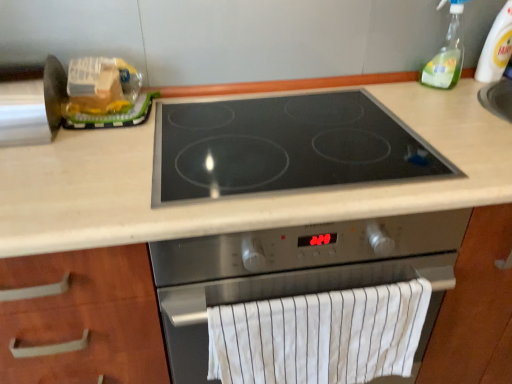
Identify the location of blank space to the left of clear plastic bottle at upper right. The width and height of the screenshot is (512, 384). (392, 92).